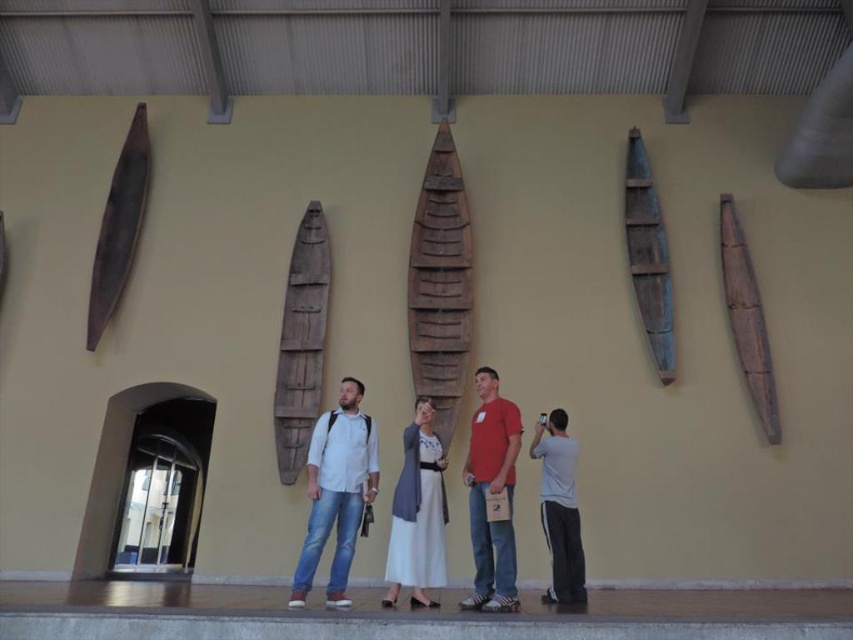
Question: Based on their relative distances, which object is farther from the wooden canoe at center?

Choices:
 (A) matte red t-shirt at center
 (B) wooden canoe at right
 (C) white matte shirt at center
 (D) white cotton dress at center

Answer: (C)

Question: Is brown wooden canoe at center smaller than white cotton dress at center?

Choices:
 (A) yes
 (B) no

Answer: (B)

Question: Considering the real-world distances, which object is closest to the white cotton dress at center?

Choices:
 (A) white matte shirt at center
 (B) wooden canoe at right

Answer: (A)

Question: Can you confirm if white matte shirt at center is positioned above brown wooden canoe at center?

Choices:
 (A) no
 (B) yes

Answer: (A)

Question: Which object appears closest to the camera in this image?

Choices:
 (A) brown wooden canoe at center
 (B) gray cotton shirt at center
 (C) white matte shirt at center
 (D) white cotton dress at center

Answer: (C)

Question: Can you confirm if wooden canoe at center is thinner than white matte shirt at center?

Choices:
 (A) no
 (B) yes

Answer: (A)